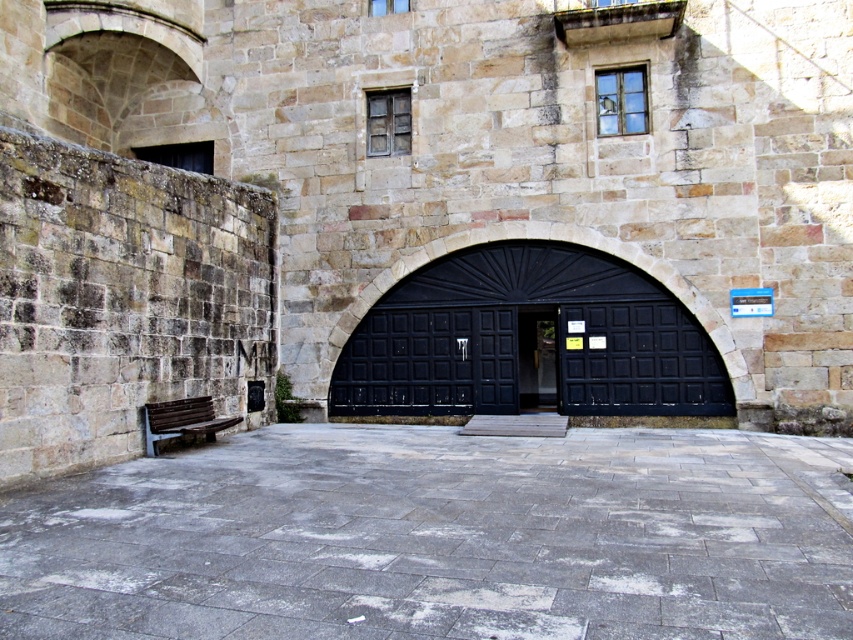
Is point (669, 372) behind point (714, 404)?

Yes.

Who is more distant from viewer, [677,374] or [663,374]?

Positioned behind is point [663,374].

Who is more distant from viewer, (347, 349) or (573, 404)?

The point (347, 349) is more distant.

The height and width of the screenshot is (640, 853). I want to click on black wooden gate at center, so click(x=527, y=339).

Between black wooden gate at center and brown wooden bench at lower left, which one has less height?

black wooden gate at center is shorter.

Does black wooden gate at center have a larger size compared to brown wooden bench at lower left?

No, black wooden gate at center is not bigger than brown wooden bench at lower left.

Does point (476, 413) come farther from viewer compared to point (154, 436)?

Yes, point (476, 413) is behind point (154, 436).

You are a GUI agent. You are given a task and a screenshot of the screen. Output one action in this format:
    pyautogui.click(x=<x>, y=<y>)
    Task: Click on the black wooden gate at center
    
    Given the screenshot: What is the action you would take?
    pyautogui.click(x=527, y=339)

How far apart are black wooden door at center and brown wooden bench at lower left?

A distance of 28.44 feet exists between black wooden door at center and brown wooden bench at lower left.

Does point (518, 380) lie behind point (189, 401)?

Yes, it is.

Between point (550, 317) and point (178, 426), which one is positioned in front?

Point (178, 426) is in front.

What are the coordinates of `black wooden door at center` in the screenshot? It's located at (537, 355).